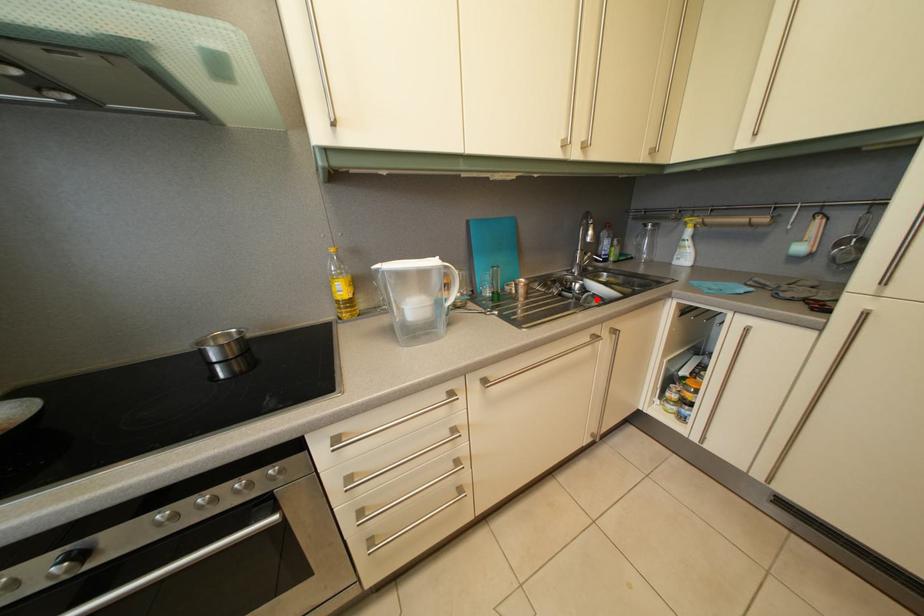
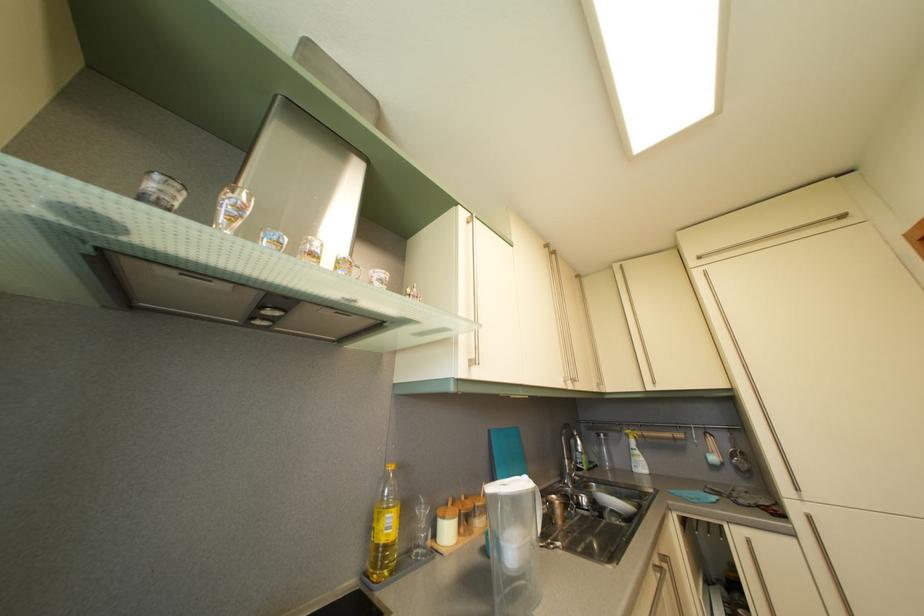
The point at the highlighted location is marked in the first image. Where is the corresponding point in the second image?

(613, 516)